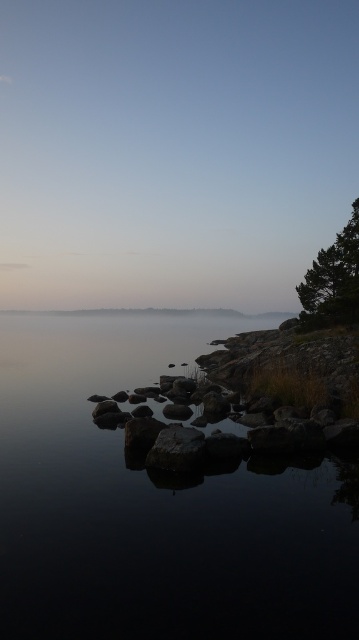
You are standing at the lakeside and want to reach the point marked as point (90, 332). Given that your walking speed is 1.5 meters per second, how many seconds will it take you to reach that point?

The point (90, 332) is 122.25 meters away from the viewer. At a walking speed of 1.5 meters per second, it would take 122.25 divided by 1.5, which equals 81.5 seconds to reach the point.

Based on the scene description, which object is taller between the transparent water at center and the green textured tree at right?

The green textured tree at right is taller than the transparent water at center.